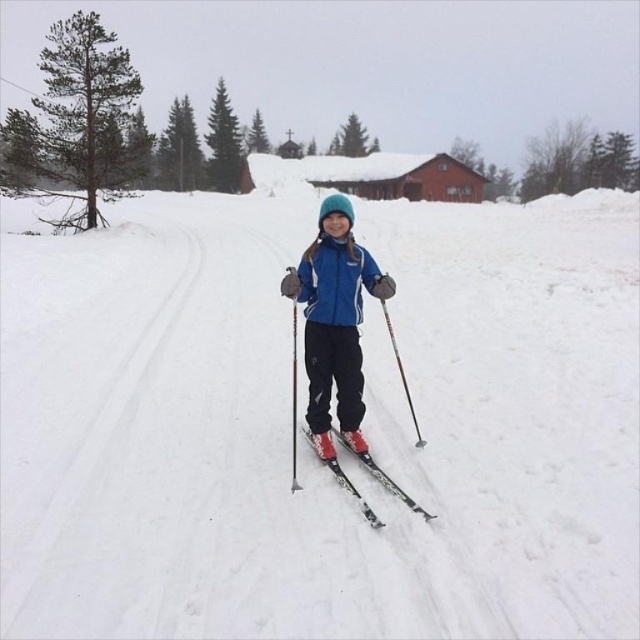
Question: Which point is farther to the camera?

Choices:
 (A) shiny black skis at center
 (B) blue matte jacket at center
 (C) metallic silver ski pole at center

Answer: (B)

Question: Does shiny black skis at center appear over metallic silver ski pole at center?

Choices:
 (A) yes
 (B) no

Answer: (A)

Question: Does white matte snow at center have a smaller size compared to metallic silver ski pole at center?

Choices:
 (A) no
 (B) yes

Answer: (A)

Question: Which object is the farthest from the shiny black skis at center?

Choices:
 (A) white matte snow at center
 (B) blue matte jacket at center
 (C) metallic silver ski pole at center

Answer: (A)

Question: Estimate the real-world distances between objects in this image. Which object is closer to the blue matte jacket at center?

Choices:
 (A) white matte snow at center
 (B) shiny black skis at center

Answer: (B)

Question: Does blue matte jacket at center lie in front of shiny black skis at center?

Choices:
 (A) yes
 (B) no

Answer: (B)